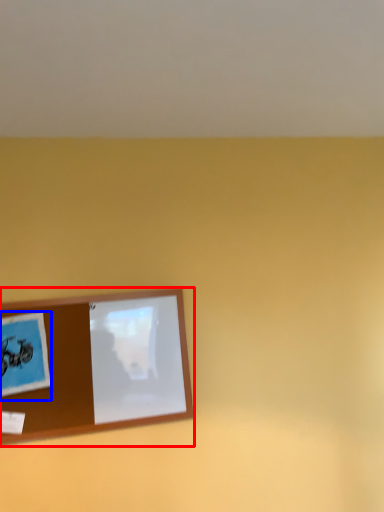
Question: Which object appears closest to the camera in this image, picture frame (highlighted by a red box) or postcard (highlighted by a blue box)?

Choices:
 (A) picture frame
 (B) postcard

Answer: (B)